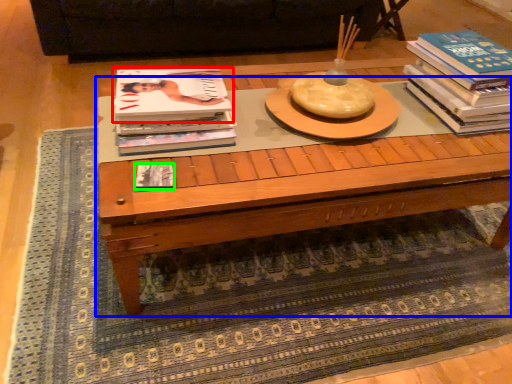
Question: Which object is positioned farthest from book (highlighted by a red box)? Select from coffee table (highlighted by a blue box) and book (highlighted by a green box).

Choices:
 (A) coffee table
 (B) book

Answer: (A)